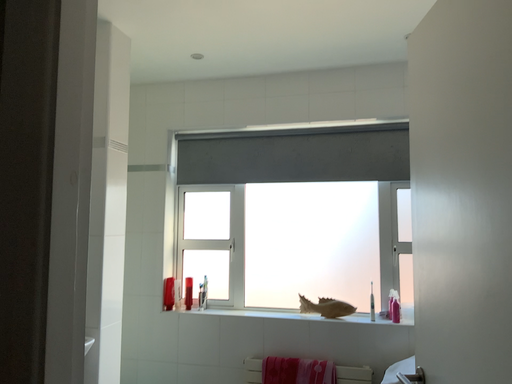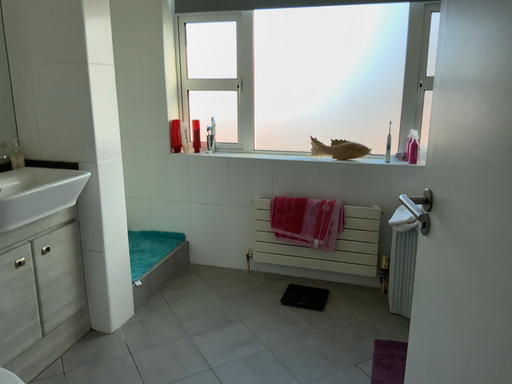
Question: How did the camera likely rotate when shooting the video?

Choices:
 (A) rotated upward
 (B) rotated downward

Answer: (B)